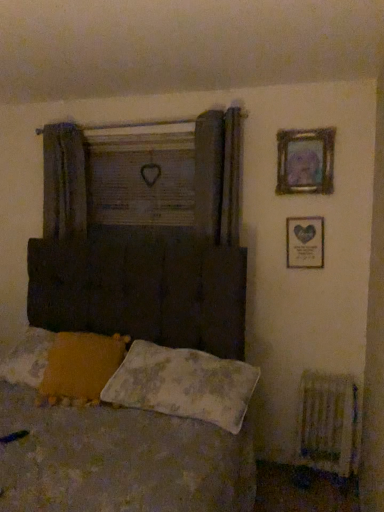
Describe the element at coordinates (305, 242) in the screenshot. I see `metallic silver picture frame at upper right, which is counted as the second picture frame, starting from the top` at that location.

At what (x,y) coordinates should I click in order to perform the action: click on yellow fabric pillow at lower left, placed as the first pillow when sorted from left to right. Please return your answer as a coordinate pair (x, y). The height and width of the screenshot is (512, 384). Looking at the image, I should click on (80, 367).

Describe the element at coordinates (305, 161) in the screenshot. This screenshot has width=384, height=512. I see `metallic gold picture frame at upper right, the second picture frame ordered from the bottom` at that location.

What do you see at coordinates (328, 423) in the screenshot? I see `white plastic radiator at lower right` at bounding box center [328, 423].

This screenshot has width=384, height=512. What do you see at coordinates (141, 179) in the screenshot?
I see `wooden frame at upper center` at bounding box center [141, 179].

Locate an element on the screen. metallic silver picture frame at upper right, the first picture frame from the bottom is located at coordinates (305, 242).

Is metallic gold picture frame at upper right, the second picture frame ordered from the bottom, at the back of fluffy white pillow at lower center, which is the second pillow from left to right?

That's not correct — fluffy white pillow at lower center, which is the second pillow from left to right, is not looking away from metallic gold picture frame at upper right, the second picture frame ordered from the bottom.

Do you think fluffy white pillow at lower center, placed as the 1th pillow when sorted from right to left, is within metallic gold picture frame at upper right, the second picture frame ordered from the bottom, or outside of it?

fluffy white pillow at lower center, placed as the 1th pillow when sorted from right to left, is spatially situated outside metallic gold picture frame at upper right, the second picture frame ordered from the bottom.

Which of these two, fluffy white pillow at lower center, placed as the 1th pillow when sorted from right to left, or metallic gold picture frame at upper right, the first picture frame when ordered from top to bottom, is smaller?

With smaller size is metallic gold picture frame at upper right, the first picture frame when ordered from top to bottom.

Is fluffy white pillow at lower center, placed as the 1th pillow when sorted from right to left, closer to camera compared to metallic silver picture frame at upper right, which is counted as the second picture frame, starting from the top?

That is True.

Is fluffy white pillow at lower center, placed as the 1th pillow when sorted from right to left, located outside metallic silver picture frame at upper right, the first picture frame from the bottom?

Indeed, fluffy white pillow at lower center, placed as the 1th pillow when sorted from right to left, is completely outside metallic silver picture frame at upper right, the first picture frame from the bottom.

Considering the sizes of objects fluffy white pillow at lower center, which is the second pillow from left to right, and metallic silver picture frame at upper right, the first picture frame from the bottom, in the image provided, who is wider, fluffy white pillow at lower center, which is the second pillow from left to right, or metallic silver picture frame at upper right, the first picture frame from the bottom,?

fluffy white pillow at lower center, which is the second pillow from left to right.

Which object is positioned more to the left, fluffy white pillow at lower center, placed as the 1th pillow when sorted from right to left, or metallic silver picture frame at upper right, the first picture frame from the bottom?

fluffy white pillow at lower center, placed as the 1th pillow when sorted from right to left, is more to the left.

Can you confirm if yellow fabric pillow at lower left, placed as the first pillow when sorted from left to right, is taller than metallic gold picture frame at upper right, the first picture frame when ordered from top to bottom?

In fact, yellow fabric pillow at lower left, placed as the first pillow when sorted from left to right, may be shorter than metallic gold picture frame at upper right, the first picture frame when ordered from top to bottom.

From a real-world perspective, which is physically above, yellow fabric pillow at lower left, placed as the first pillow when sorted from left to right, or metallic gold picture frame at upper right, the first picture frame when ordered from top to bottom?

metallic gold picture frame at upper right, the first picture frame when ordered from top to bottom.

Is yellow fabric pillow at lower left, placed as the first pillow when sorted from left to right, positioned beyond the bounds of metallic gold picture frame at upper right, the second picture frame ordered from the bottom?

yellow fabric pillow at lower left, placed as the first pillow when sorted from left to right, is positioned outside metallic gold picture frame at upper right, the second picture frame ordered from the bottom.

Is metallic gold picture frame at upper right, the first picture frame when ordered from top to bottom, at the back of yellow fabric pillow at lower left, which is the 2th pillow in right-to-left order?

No, yellow fabric pillow at lower left, which is the 2th pillow in right-to-left order,'s orientation is not away from metallic gold picture frame at upper right, the first picture frame when ordered from top to bottom.

Is yellow fabric pillow at lower left, placed as the first pillow when sorted from left to right, turned away from wooden frame at upper center?

That's not correct — yellow fabric pillow at lower left, placed as the first pillow when sorted from left to right, is not looking away from wooden frame at upper center.

Consider the image. From the image's perspective, which is below, yellow fabric pillow at lower left, which is the 2th pillow in right-to-left order, or wooden frame at upper center?

yellow fabric pillow at lower left, which is the 2th pillow in right-to-left order, from the image's perspective.

Can you confirm if yellow fabric pillow at lower left, placed as the first pillow when sorted from left to right, is shorter than wooden frame at upper center?

Correct, yellow fabric pillow at lower left, placed as the first pillow when sorted from left to right, is not as tall as wooden frame at upper center.

Can you confirm if white plastic radiator at lower right is taller than metallic gold picture frame at upper right, the first picture frame when ordered from top to bottom?

Yes, white plastic radiator at lower right is taller than metallic gold picture frame at upper right, the first picture frame when ordered from top to bottom.

Is white plastic radiator at lower right facing away from metallic gold picture frame at upper right, the second picture frame ordered from the bottom?

No, white plastic radiator at lower right's orientation is not away from metallic gold picture frame at upper right, the second picture frame ordered from the bottom.

From a real-world perspective, is white plastic radiator at lower right on top of metallic gold picture frame at upper right, the first picture frame when ordered from top to bottom?

Incorrect, from a real-world perspective, white plastic radiator at lower right is lower than metallic gold picture frame at upper right, the first picture frame when ordered from top to bottom.

Is white plastic radiator at lower right positioned beyond the bounds of metallic gold picture frame at upper right, the second picture frame ordered from the bottom?

white plastic radiator at lower right is positioned outside metallic gold picture frame at upper right, the second picture frame ordered from the bottom.

Looking at this image, between white plastic radiator at lower right and fluffy white pillow at lower center, placed as the 1th pillow when sorted from right to left, which one has larger size?

fluffy white pillow at lower center, placed as the 1th pillow when sorted from right to left.

Are white plastic radiator at lower right and fluffy white pillow at lower center, which is the second pillow from left to right, making contact?

white plastic radiator at lower right and fluffy white pillow at lower center, which is the second pillow from left to right, are clearly separated.

From a real-world perspective, is white plastic radiator at lower right positioned over fluffy white pillow at lower center, which is the second pillow from left to right, based on gravity?

No.

Does white plastic radiator at lower right turn towards fluffy white pillow at lower center, which is the second pillow from left to right?

No, white plastic radiator at lower right is not facing towards fluffy white pillow at lower center, which is the second pillow from left to right.

From the image's perspective, is fluffy white pillow at lower center, which is the second pillow from left to right, beneath textured fabric bed at center?

No.

Does fluffy white pillow at lower center, which is the second pillow from left to right, turn towards textured fabric bed at center?

Yes.

Which is more to the left, fluffy white pillow at lower center, placed as the 1th pillow when sorted from right to left, or textured fabric bed at center?

Positioned to the left is textured fabric bed at center.

Do you think fluffy white pillow at lower center, placed as the 1th pillow when sorted from right to left, is within textured fabric bed at center, or outside of it?

fluffy white pillow at lower center, placed as the 1th pillow when sorted from right to left, is located inside textured fabric bed at center.

From the image's perspective, count 2nd pillows downward from the metallic gold picture frame at upper right, the first picture frame when ordered from top to bottom, and point to it. Please provide its 2D coordinates.

[(183, 384)]

Which picture frame is the 2nd one when counting from the right side of the fluffy white pillow at lower center, placed as the 1th pillow when sorted from right to left? Please provide its 2D coordinates.

[(305, 242)]

Based on their spatial positions, is white plastic radiator at lower right or wooden frame at upper center further from metallic gold picture frame at upper right, the second picture frame ordered from the bottom?

white plastic radiator at lower right.

From the image, which object appears to be nearer to metallic silver picture frame at upper right, the first picture frame from the bottom, fluffy white pillow at lower center, placed as the 1th pillow when sorted from right to left, or metallic gold picture frame at upper right, the first picture frame when ordered from top to bottom?

metallic gold picture frame at upper right, the first picture frame when ordered from top to bottom, lies closer to metallic silver picture frame at upper right, the first picture frame from the bottom, than the other object.

Estimate the real-world distances between objects in this image. Which object is further from wooden frame at upper center, yellow fabric pillow at lower left, placed as the first pillow when sorted from left to right, or metallic silver picture frame at upper right, the first picture frame from the bottom?

Among the two, yellow fabric pillow at lower left, placed as the first pillow when sorted from left to right, is located further to wooden frame at upper center.

Estimate the real-world distances between objects in this image. Which object is further from textured fabric bed at center, metallic gold picture frame at upper right, the second picture frame ordered from the bottom, or yellow fabric pillow at lower left, placed as the first pillow when sorted from left to right?

Based on the image, metallic gold picture frame at upper right, the second picture frame ordered from the bottom, appears to be further to textured fabric bed at center.

When comparing their distances from yellow fabric pillow at lower left, placed as the first pillow when sorted from left to right, does metallic gold picture frame at upper right, the first picture frame when ordered from top to bottom, or wooden frame at upper center seem closer?

wooden frame at upper center.

When comparing their distances from yellow fabric pillow at lower left, which is the 2th pillow in right-to-left order, does textured fabric bed at center or metallic silver picture frame at upper right, which is counted as the second picture frame, starting from the top, seem closer?

textured fabric bed at center is closer to yellow fabric pillow at lower left, which is the 2th pillow in right-to-left order.

From the picture: Looking at the image, which one is located closer to white plastic radiator at lower right, textured fabric bed at center or yellow fabric pillow at lower left, placed as the first pillow when sorted from left to right?

textured fabric bed at center.

When comparing their distances from textured fabric bed at center, does metallic silver picture frame at upper right, which is counted as the second picture frame, starting from the top, or wooden frame at upper center seem further?

metallic silver picture frame at upper right, which is counted as the second picture frame, starting from the top.

At what (x,y) coordinates should I click in order to perform the action: click on picture frame between wooden frame at upper center and white plastic radiator at lower right from top to bottom. Please return your answer as a coordinate pair (x, y). Looking at the image, I should click on (305, 242).

You are a GUI agent. You are given a task and a screenshot of the screen. Output one action in this format:
    pyautogui.click(x=<x>, y=<y>)
    Task: Click on the radiator located between textured fabric bed at center and metallic silver picture frame at upper right, which is counted as the second picture frame, starting from the top, in the depth direction
    Image resolution: width=384 pixels, height=512 pixels.
    Given the screenshot: What is the action you would take?
    pyautogui.click(x=328, y=423)

Find the location of `window screen that lies between metallic gold picture frame at upper right, the second picture frame ordered from the bottom, and white plastic radiator at lower right from top to bottom`. window screen that lies between metallic gold picture frame at upper right, the second picture frame ordered from the bottom, and white plastic radiator at lower right from top to bottom is located at coordinates (141, 179).

The width and height of the screenshot is (384, 512). What are the coordinates of `window screen between yellow fabric pillow at lower left, placed as the first pillow when sorted from left to right, and metallic gold picture frame at upper right, the second picture frame ordered from the bottom, from left to right` in the screenshot? It's located at (141, 179).